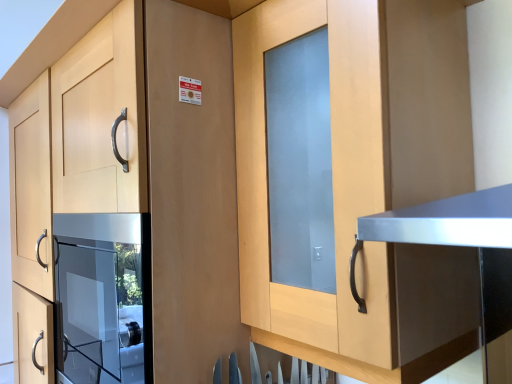
Identify the location of matte wood cabinet at center. This screenshot has height=384, width=512. (144, 171).

The image size is (512, 384). What do you see at coordinates (144, 171) in the screenshot?
I see `matte wood cabinet at center` at bounding box center [144, 171].

At what (x,y) coordinates should I click in order to perform the action: click on matte wood cabinet at center. Please return your answer as a coordinate pair (x, y). Image resolution: width=512 pixels, height=384 pixels. Looking at the image, I should click on (144, 171).